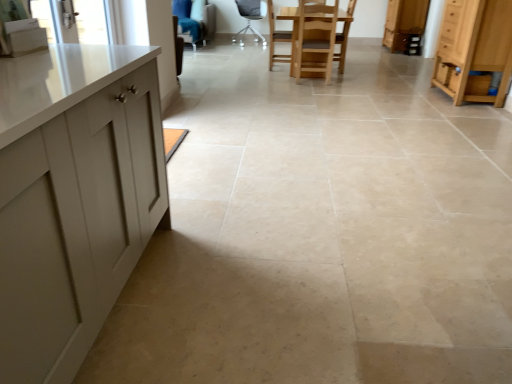
Question: In terms of width, does light blue fabric armchair at upper center, which is the second armchair in front-to-back order, look wider or thinner when compared to wooden cabinet at upper right, the 2th cabinetry from the front?

Choices:
 (A) thin
 (B) wide

Answer: (B)

Question: Is point (206, 4) closer or farther from the camera than point (391, 4)?

Choices:
 (A) farther
 (B) closer

Answer: (B)

Question: Estimate the real-world distances between objects in this image. Which object is farther from the light wood cabinet at right, which is counted as the 1th cabinetry, starting from the front?

Choices:
 (A) wooden cabinet at upper right, which is the second cabinetry in bottom-to-top order
 (B) wooden chair at center, which appears as the second armchair when viewed from the left
 (C) clear glass window screen at upper left
 (D) light blue fabric armchair at upper center, arranged as the first armchair when viewed from the left
 (E) metallic gray chair at center, the second chair positioned from the right

Answer: (D)

Question: Based on their relative distances, which object is farther from the clear glass window screen at upper left?

Choices:
 (A) light blue fabric armchair at upper center, arranged as the 1th armchair when viewed from the back
 (B) wooden cabinet at upper right, the 1th cabinetry when ordered from top to bottom
 (C) wooden chair at center, arranged as the second chair when viewed from the back
 (D) light wood cabinet at right, acting as the 2th cabinetry starting from the top
 (E) wooden chair at center, which is the second armchair in back-to-front order

Answer: (B)